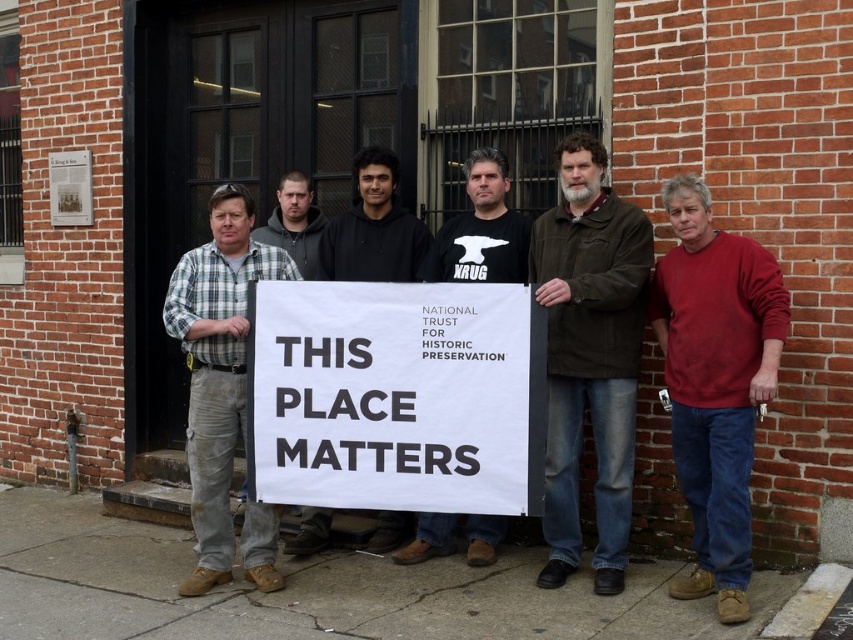
Question: Which object appears farthest from the camera in this image?

Choices:
 (A) plaid shirt at center
 (B) black cotton hoodie at center
 (C) white paper sign at center

Answer: (B)

Question: Is white paper sign at center bigger than dark gray hoodie at center?

Choices:
 (A) yes
 (B) no

Answer: (A)

Question: Which of the following is the closest to the observer?

Choices:
 (A) dark gray hoodie at center
 (B) red cotton sweater at right
 (C) black cotton hoodie at center

Answer: (B)

Question: Does plaid shirt at center have a smaller size compared to dark gray hoodie at center?

Choices:
 (A) yes
 (B) no

Answer: (B)

Question: Which object appears closest to the camera in this image?

Choices:
 (A) white paper sign at center
 (B) red cotton sweater at right
 (C) dark gray hoodie at center

Answer: (B)

Question: Does black cotton hoodie at center appear over dark gray hoodie at center?

Choices:
 (A) no
 (B) yes

Answer: (A)